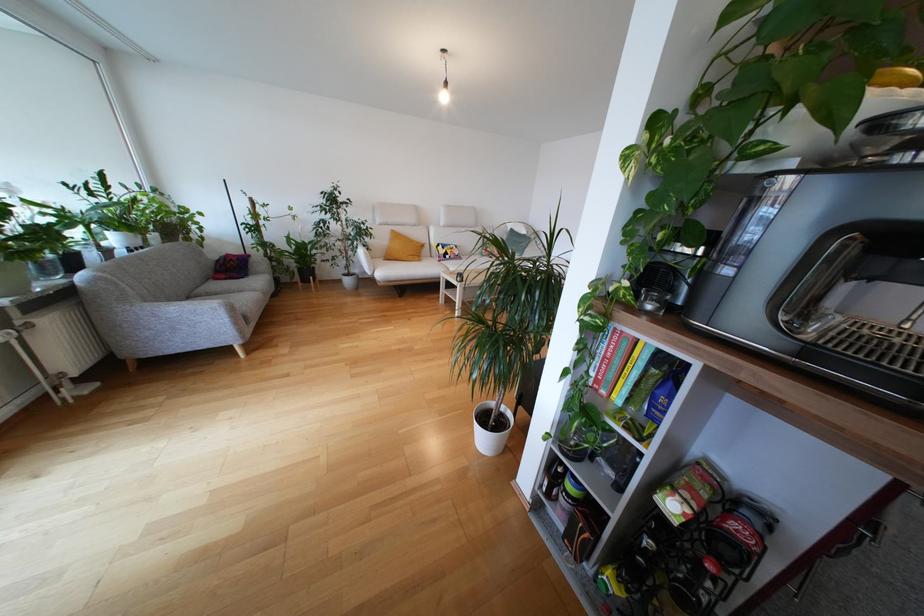
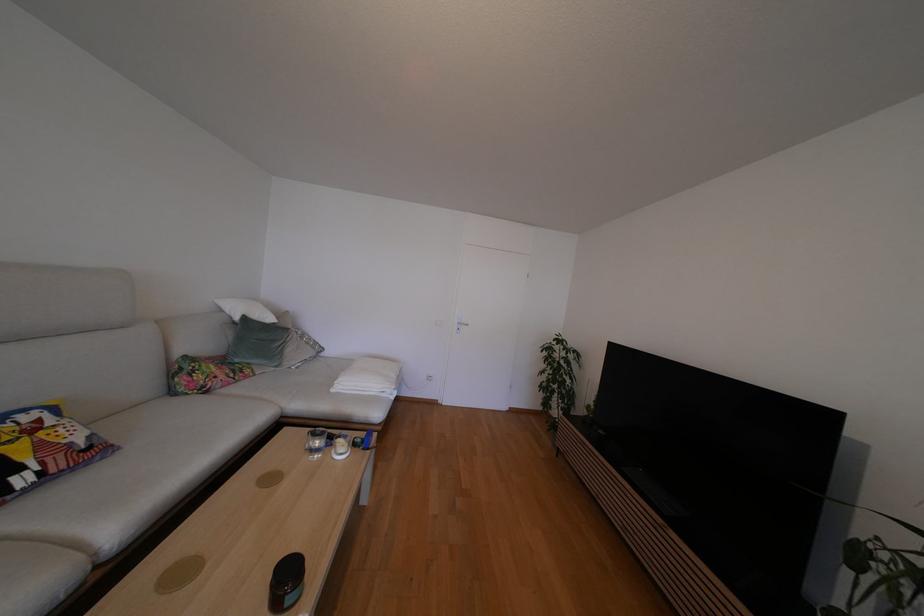
Find the pixel in the second image that matches [456,254] in the first image.

(44, 448)